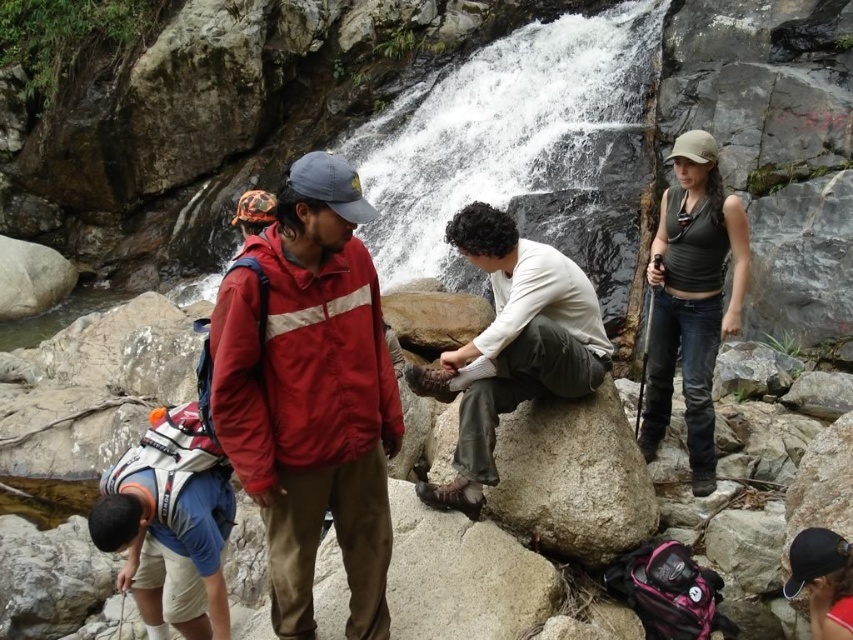
You are a photographer positioned at the camera location. You want to take a photo of both point (491, 218) and point (714, 216) in the scene. Which point is closer to your current position?

Point (491, 218) is closer to the camera than point (714, 216), so it is closer to your current position.

You are a photographer trying to capture a group photo of the white matte shirt at center and the matte green tank top at right. Since you want to ensure both subjects are in focus, you need to know which one is wider. Which one has a greater width?

The white matte shirt at center has a greater width than the matte green tank top at right.